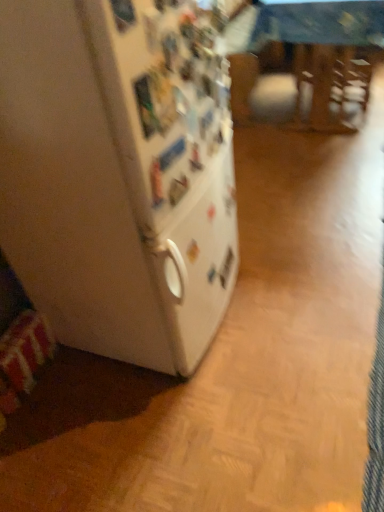
Question: Looking at the image, does wooden table at center seem bigger or smaller compared to white matte refrigerator at left?

Choices:
 (A) big
 (B) small

Answer: (A)

Question: Is point (316, 4) closer or farther from the camera than point (115, 140)?

Choices:
 (A) closer
 (B) farther

Answer: (B)

Question: Do you think wooden table at center is within white matte refrigerator at left, or outside of it?

Choices:
 (A) inside
 (B) outside

Answer: (B)

Question: Is white matte refrigerator at left to the left or to the right of wooden table at center in the image?

Choices:
 (A) right
 (B) left

Answer: (B)

Question: Choose the correct answer: Is white matte refrigerator at left inside wooden table at center or outside it?

Choices:
 (A) outside
 (B) inside

Answer: (A)

Question: Is white matte refrigerator at left taller or shorter than wooden table at center?

Choices:
 (A) short
 (B) tall

Answer: (B)

Question: From the image's perspective, is white matte refrigerator at left located above or below wooden table at center?

Choices:
 (A) above
 (B) below

Answer: (B)